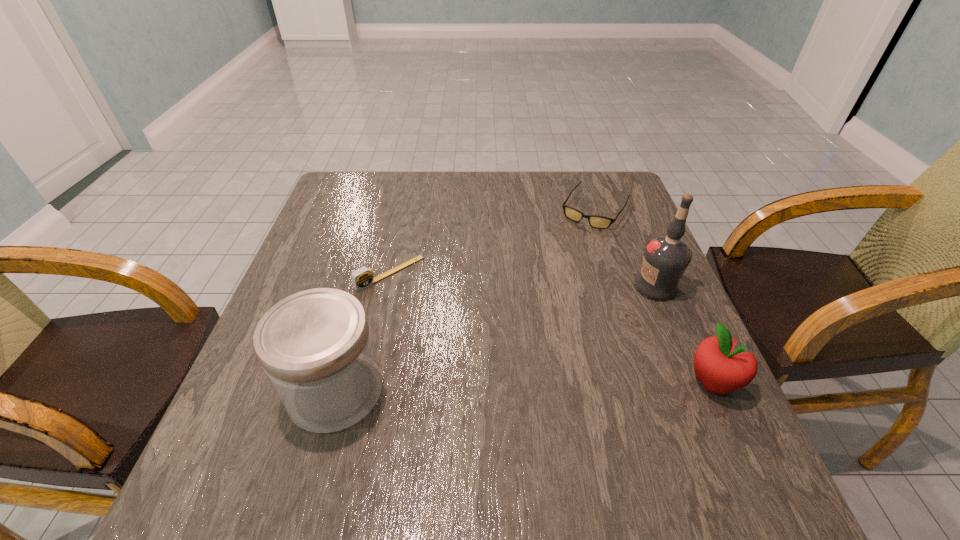
At what (x,y) coordinates should I click in order to perform the action: click on blank area at the right edge. Please return your answer as a coordinate pair (x, y). The height and width of the screenshot is (540, 960). Looking at the image, I should click on (622, 222).

At what (x,y) coordinates should I click in order to perform the action: click on free point at the far right corner. Please return your answer as a coordinate pair (x, y). Looking at the image, I should click on (595, 211).

Where is `vacant space at the near right corner of the desktop`? The image size is (960, 540). vacant space at the near right corner of the desktop is located at coordinates (693, 440).

Find the location of a particular element. The image size is (960, 540). free point between the tape measure and the third shortest object is located at coordinates (551, 328).

You are a GUI agent. You are given a task and a screenshot of the screen. Output one action in this format:
    pyautogui.click(x=<x>, y=<y>)
    Task: Click on the vacant point located between the vodka and the tape measure
    This screenshot has width=960, height=540.
    Given the screenshot: What is the action you would take?
    pyautogui.click(x=523, y=280)

Where is `free spot between the third tallest object and the tape measure`? This screenshot has height=540, width=960. free spot between the third tallest object and the tape measure is located at coordinates (551, 328).

Find the location of a particular element. free space between the vodka and the tape measure is located at coordinates (523, 280).

Where is `empty space that is in between the farthest object and the vodka`? The image size is (960, 540). empty space that is in between the farthest object and the vodka is located at coordinates (625, 248).

The width and height of the screenshot is (960, 540). I want to click on free space between the farthest object and the tape measure, so click(x=492, y=241).

Identify the location of vacant area that lies between the farthest object and the tallest object. This screenshot has height=540, width=960. (625, 248).